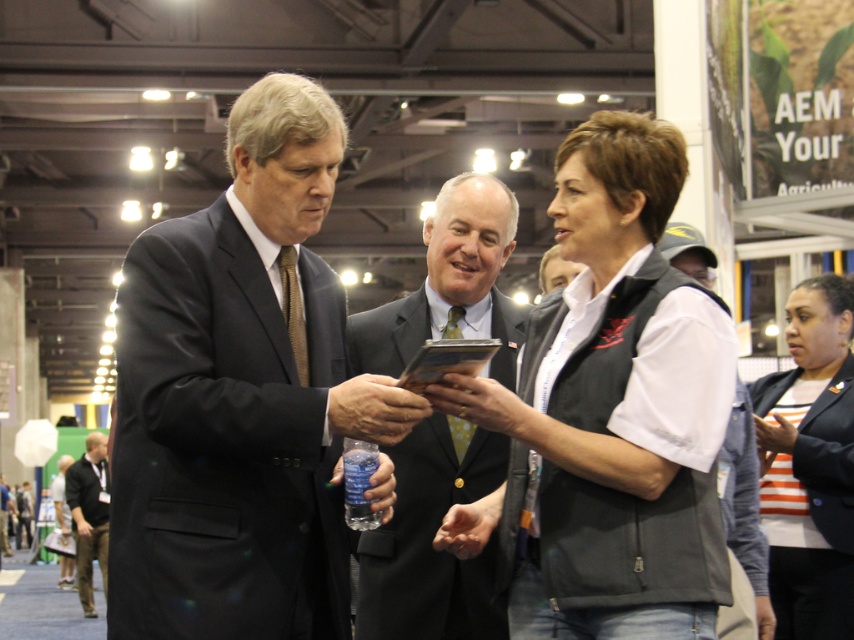
Question: Observing the image, what is the correct spatial positioning of matte black suit at center in reference to dark gray suit at center?

Choices:
 (A) right
 (B) left

Answer: (A)

Question: Which point is farther to the camera?

Choices:
 (A) (389, 451)
 (B) (91, 614)
 (C) (183, 596)
 (D) (568, 204)

Answer: (B)

Question: Does matte black suit at center lie behind black cotton shirt at lower left?

Choices:
 (A) no
 (B) yes

Answer: (A)

Question: Is matte black suit at center thinner than dark suit at center?

Choices:
 (A) yes
 (B) no

Answer: (B)

Question: Which of these objects is positioned farthest from the matte black vest at center?

Choices:
 (A) dark suit at center
 (B) dark gray suit at center
 (C) matte black suit at center

Answer: (B)

Question: Which object is positioned closest to the matte black suit at center?

Choices:
 (A) denim jacket at right
 (B) black cotton shirt at lower left

Answer: (A)